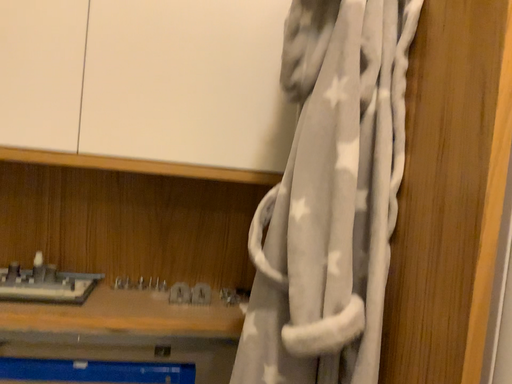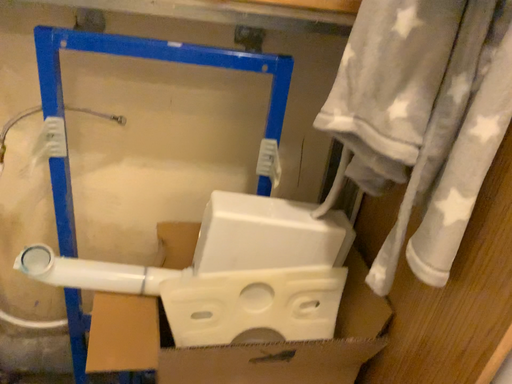
Question: Which way did the camera rotate in the video?

Choices:
 (A) rotated upward
 (B) rotated downward

Answer: (B)